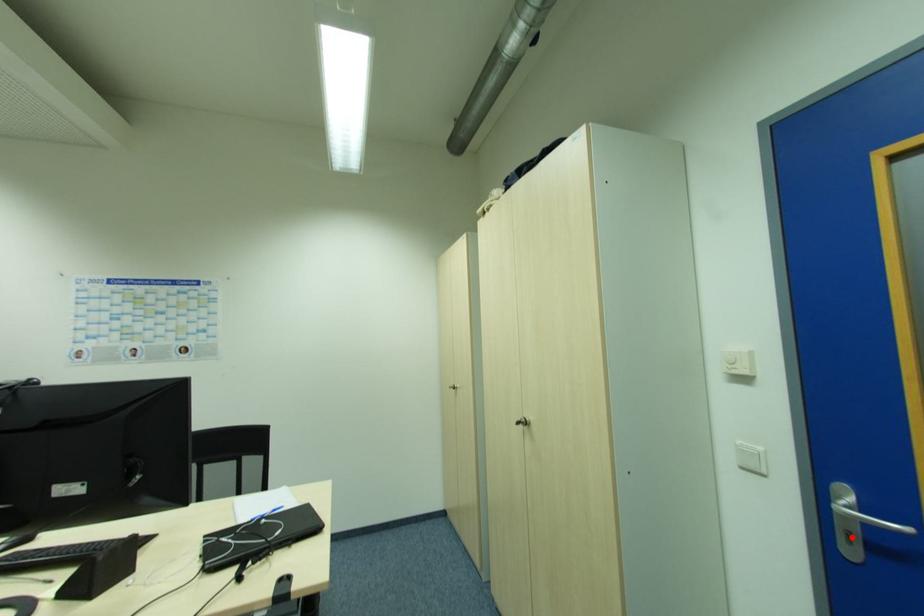
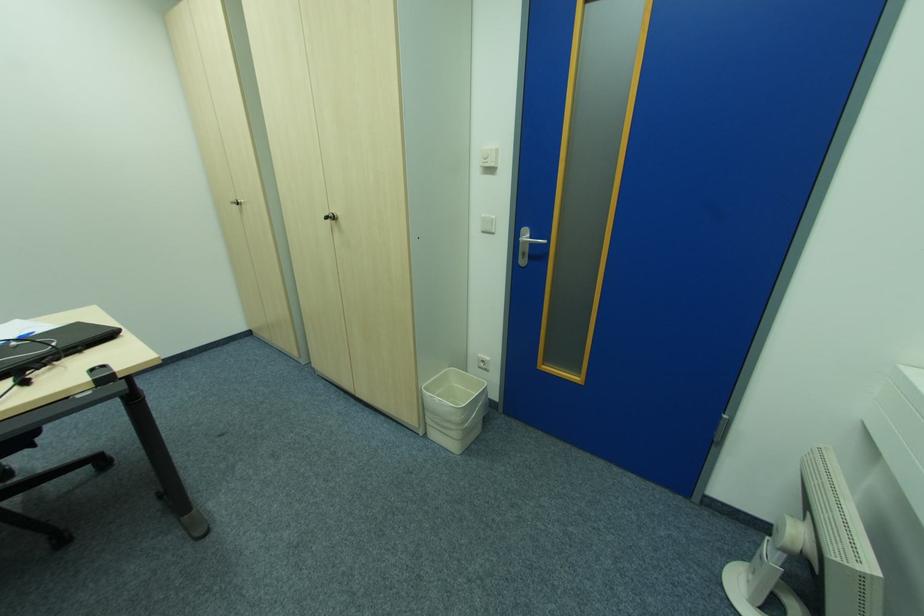
Where in the second image is the point corresponding to the highlighted location from the first image?

(526, 256)